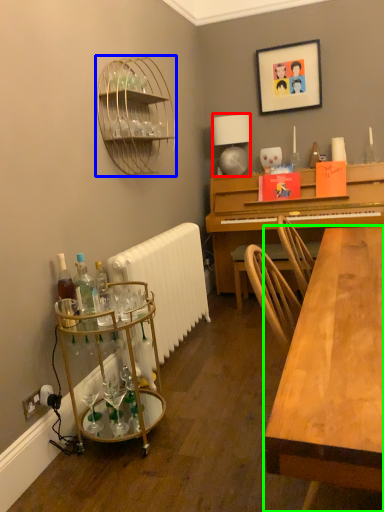
Question: Which is nearer to the lamp (highlighted by a red box)? shelf (highlighted by a blue box) or desk (highlighted by a green box).

Choices:
 (A) shelf
 (B) desk

Answer: (A)